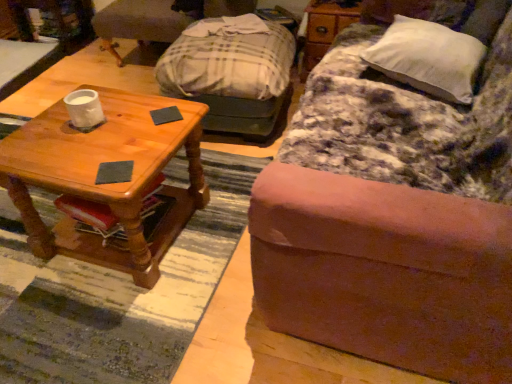
Identify the location of free space behind dark gray matte coaster at center, acting as the 1th pad starting from the top. (161, 101).